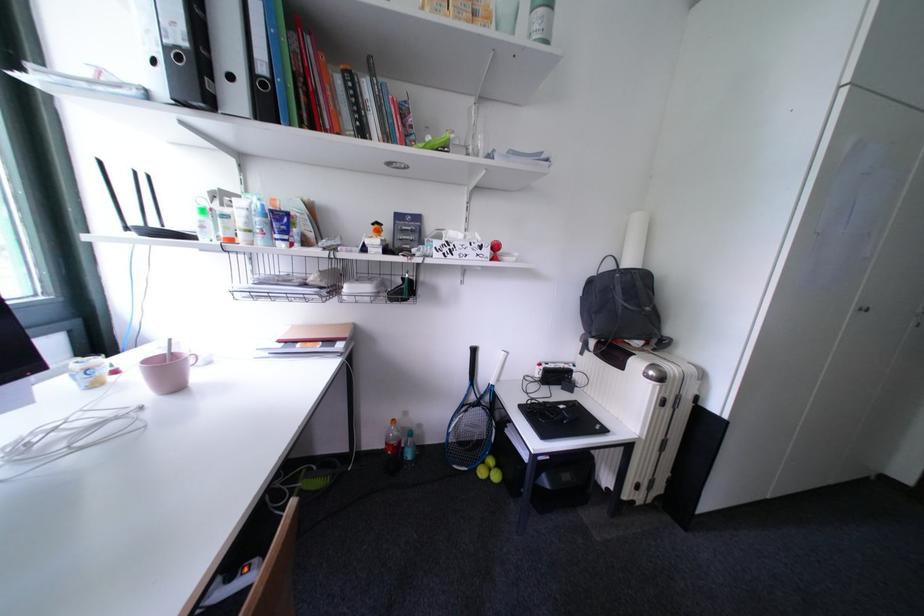
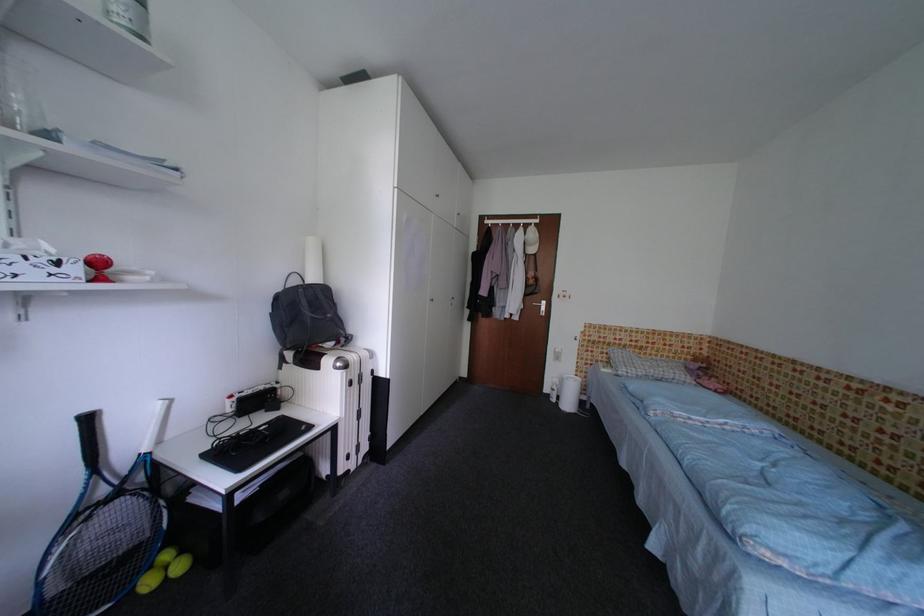
Question: The first image is from the beginning of the video and the second image is from the end. How did the camera likely rotate when shooting the video?

Choices:
 (A) Left
 (B) Right
 (C) Up
 (D) Down

Answer: (B)